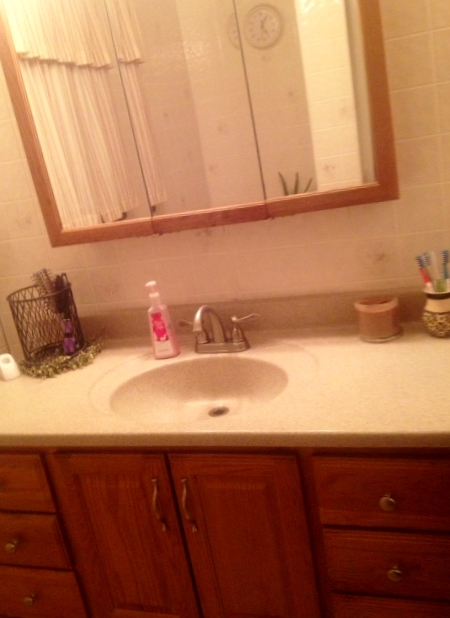
Find the location of a particular element. silver metallic sink faucet is located at coordinates (196, 326).